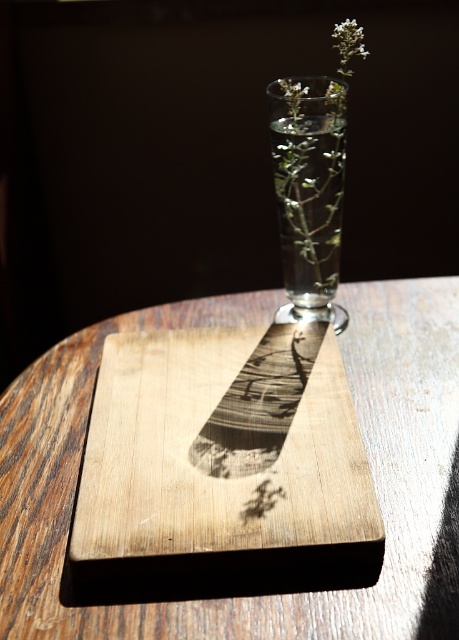
Question: Which of the following is the farthest from the observer?

Choices:
 (A) clear glass vase at center
 (B) wooden board at center

Answer: (A)

Question: Is wooden board at center above clear glass vase at center?

Choices:
 (A) yes
 (B) no

Answer: (B)

Question: Estimate the real-world distances between objects in this image. Which object is farther from the clear glass vase at center?

Choices:
 (A) white matte flower at upper center
 (B) natural wood cutting board at center
 (C) wooden board at center

Answer: (B)

Question: Can you confirm if clear glass vase at center is positioned to the left of white matte flower at upper center?

Choices:
 (A) yes
 (B) no

Answer: (A)

Question: Is clear glass vase at center wider than white matte flower at upper center?

Choices:
 (A) yes
 (B) no

Answer: (B)

Question: Estimate the real-world distances between objects in this image. Which object is farther from the white matte flower at upper center?

Choices:
 (A) wooden board at center
 (B) clear glass vase at center
 (C) natural wood cutting board at center

Answer: (A)